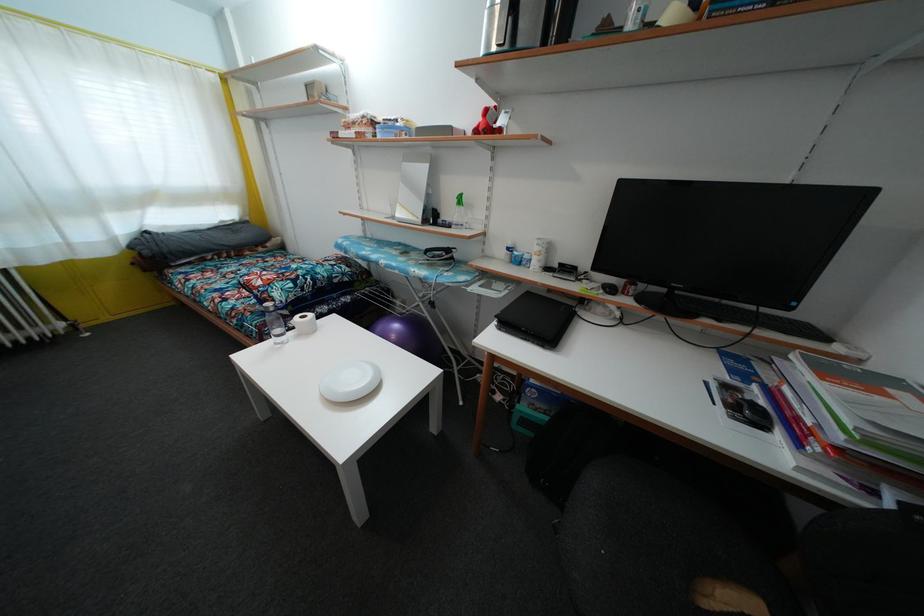
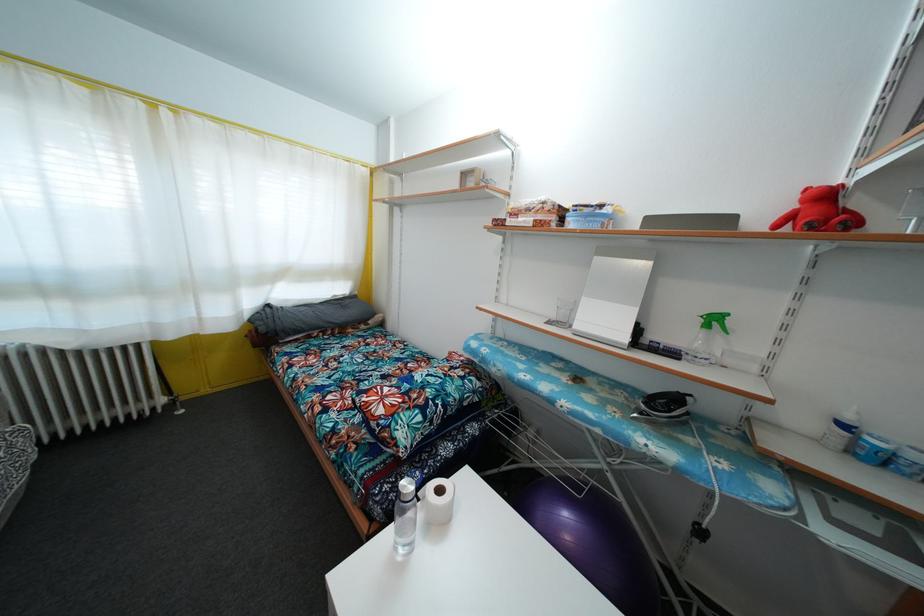
Question: The images are taken continuously from a first-person perspective. In which direction is your viewpoint rotating?

Choices:
 (A) Left
 (B) Right
 (C) Up
 (D) Down

Answer: (C)